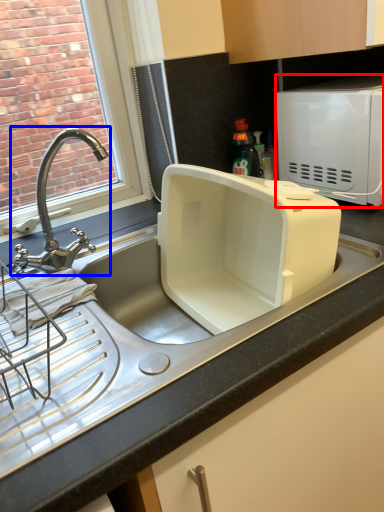
Question: Which of the following is the farthest to the observer, microwave oven (highlighted by a red box) or tap (highlighted by a blue box)?

Choices:
 (A) microwave oven
 (B) tap

Answer: (A)